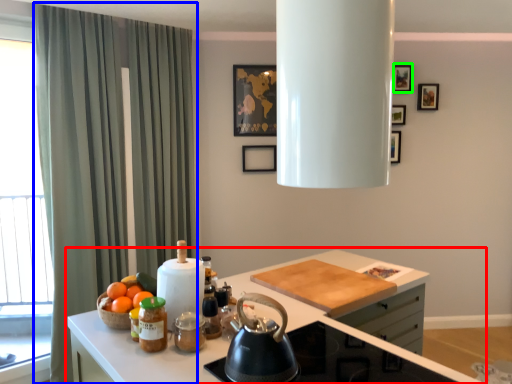
Question: Estimate the real-world distances between objects in this image. Which object is farther from countertop (highlighted by a red box), curtain (highlighted by a blue box) or picture frame (highlighted by a green box)?

Choices:
 (A) curtain
 (B) picture frame

Answer: (B)